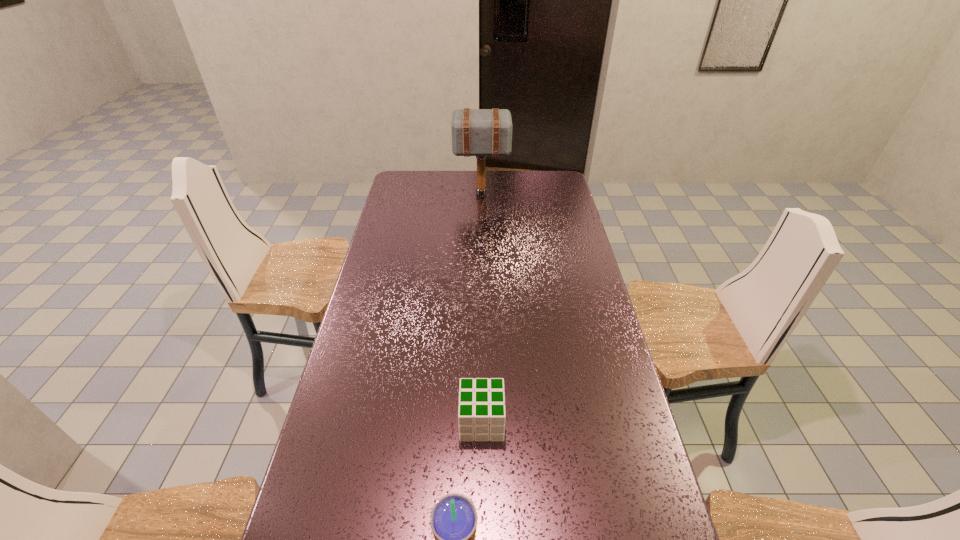
This screenshot has height=540, width=960. I want to click on vacant area that lies between the mallet and the cube, so (482, 308).

Identify the location of unoccupied position between the shortest object and the farthest object. (482, 308).

Identify which object is located as the nearest to the second shortest object. Please provide its 2D coordinates. Your answer should be formatted as a tuple, i.e. [(x, y)], where the tuple contains the x and y coordinates of a point satisfying the conditions above.

[(481, 413)]

Locate an element on the screen. the closest object to the smoothie is located at coordinates (481, 413).